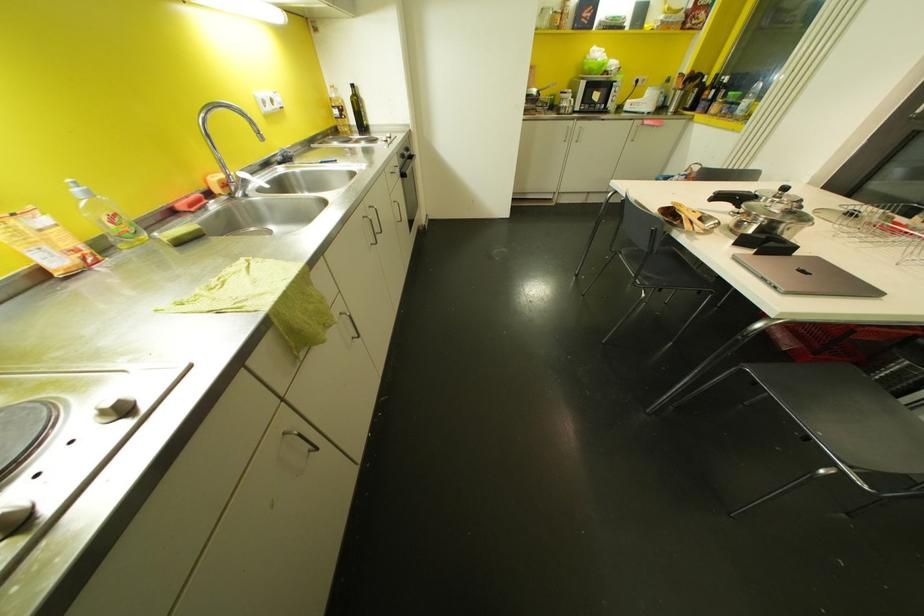
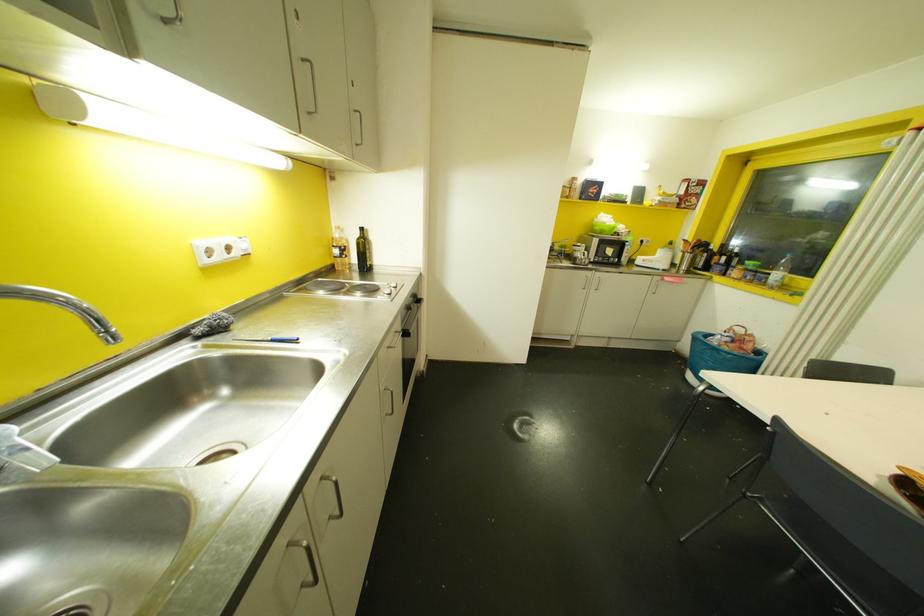
Locate, in the second image, the point that corresponds to (272,100) in the first image.

(227, 248)